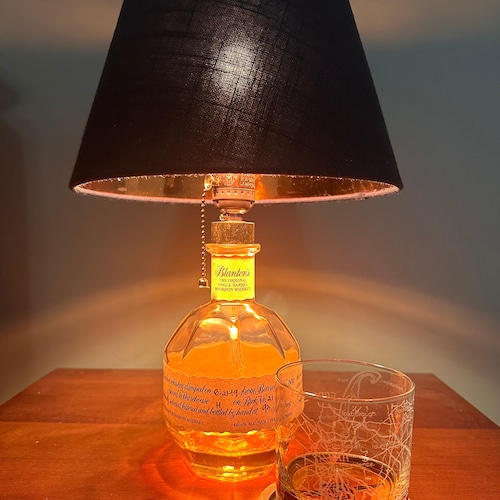
You are a GUI agent. You are given a task and a screenshot of the screen. Output one action in this format:
    pyautogui.click(x=<x>, y=<y>)
    Task: Click on the glass
    
    Given the screenshot: What is the action you would take?
    pyautogui.click(x=318, y=400)